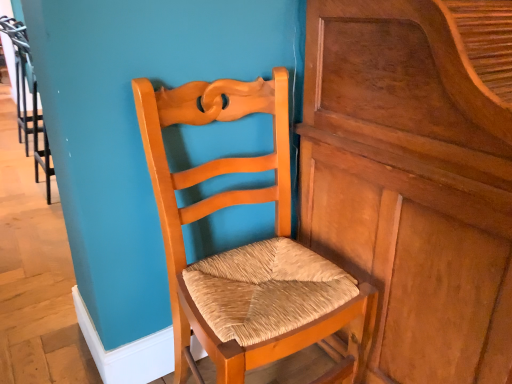
Question: Relative to matte wood chair at center, is wooden polished dresser at center in front or behind?

Choices:
 (A) behind
 (B) front

Answer: (B)

Question: From a real-world perspective, is wooden polished dresser at center above or below matte wood chair at center?

Choices:
 (A) below
 (B) above

Answer: (B)

Question: From the image's perspective, relative to matte wood chair at center, is wooden polished dresser at center above or below?

Choices:
 (A) above
 (B) below

Answer: (A)

Question: Considering the positions of matte wood chair at center and wooden polished dresser at center in the image, is matte wood chair at center wider or thinner than wooden polished dresser at center?

Choices:
 (A) thin
 (B) wide

Answer: (A)

Question: From a real-world perspective, is matte wood chair at center above or below wooden polished dresser at center?

Choices:
 (A) below
 (B) above

Answer: (A)

Question: Relative to wooden polished dresser at center, is matte wood chair at center in front or behind?

Choices:
 (A) front
 (B) behind

Answer: (B)

Question: Is point (308, 329) positioned closer to the camera than point (461, 233)?

Choices:
 (A) closer
 (B) farther

Answer: (B)